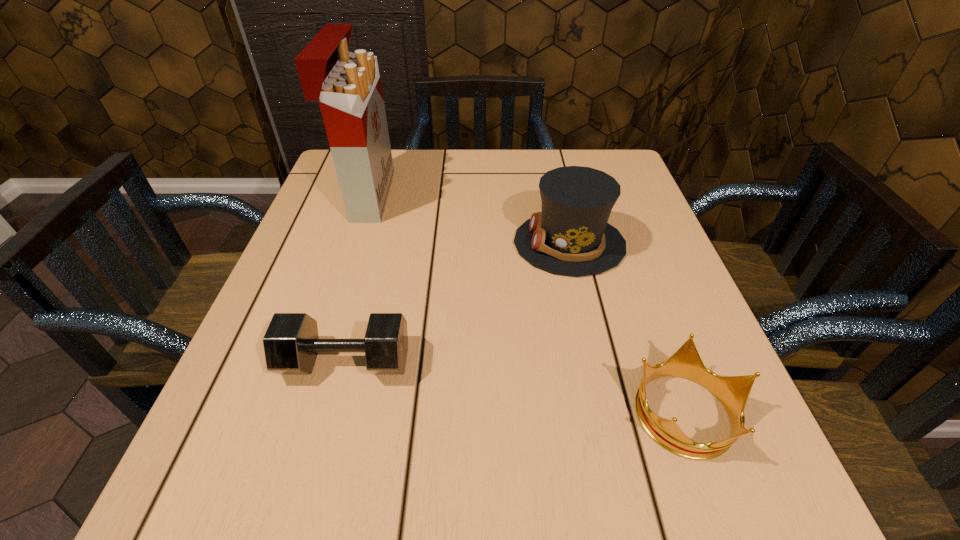
Where is `cigarette case`? cigarette case is located at coordinates (348, 86).

You are a GUI agent. You are given a task and a screenshot of the screen. Output one action in this format:
    pyautogui.click(x=<x>, y=<y>)
    Task: Click on the dress hat
    The width and height of the screenshot is (960, 540).
    Given the screenshot: What is the action you would take?
    pyautogui.click(x=571, y=236)

Identify the location of dumbbell. (291, 343).

The image size is (960, 540). In order to click on crown in this screenshot , I will do `click(732, 391)`.

Where is `free location located with the lid open on the cigarette case`? This screenshot has height=540, width=960. free location located with the lid open on the cigarette case is located at coordinates (420, 195).

Locate an element on the screen. Image resolution: width=960 pixels, height=540 pixels. vacant space located 0.190m with goggles on the front of the third shortest object is located at coordinates (426, 244).

Locate an element on the screen. The width and height of the screenshot is (960, 540). vacant space situated with goggles on the front of the third shortest object is located at coordinates (390, 244).

Locate an element on the screen. The height and width of the screenshot is (540, 960). free space located with goggles on the front of the third shortest object is located at coordinates (375, 244).

Find the location of a particular element. The height and width of the screenshot is (540, 960). free space located 0.290m on the right of the dumbbell is located at coordinates (580, 361).

Locate an element on the screen. This screenshot has height=540, width=960. vacant space situated 0.090m on the left of the crown is located at coordinates (574, 411).